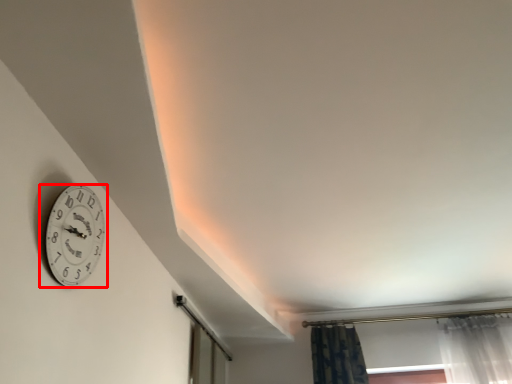
Question: In this image, where is wall clock (annotated by the red box) located relative to glass door?

Choices:
 (A) right
 (B) left

Answer: (B)